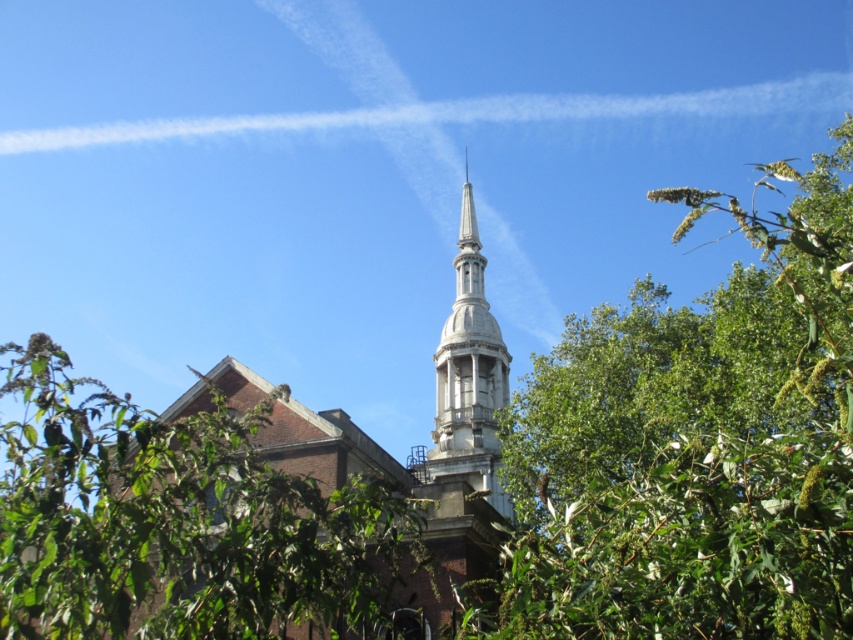
Question: Which point is farther to the camera?

Choices:
 (A) white stone church steeple at upper center
 (B) green leafy tree at center
 (C) green leafy tree at upper center
 (D) stone spire at center

Answer: (D)

Question: Among these points, which one is nearest to the camera?

Choices:
 (A) (523, 522)
 (B) (326, 440)

Answer: (B)

Question: Does white stone church steeple at upper center appear under stone spire at center?

Choices:
 (A) yes
 (B) no

Answer: (A)

Question: Which of the following is the closest to the observer?

Choices:
 (A) (463, 385)
 (B) (708, 308)
 (C) (405, 547)
 (D) (447, 588)

Answer: (C)

Question: Does green leafy tree at center appear on the left side of white stone church steeple at upper center?

Choices:
 (A) yes
 (B) no

Answer: (A)

Question: Is green leafy tree at upper center wider than green leafy tree at center?

Choices:
 (A) yes
 (B) no

Answer: (B)